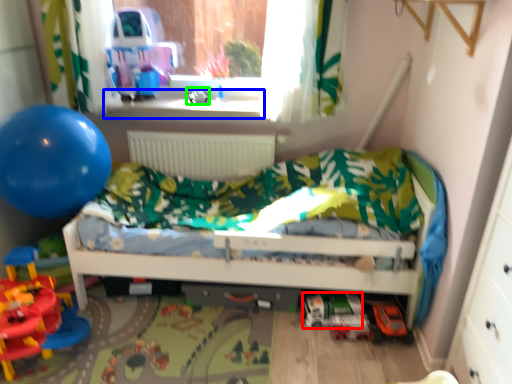
Question: Which object is positioned closest to toy (highlighted by a red box)? Select from window sill (highlighted by a blue box) and toy (highlighted by a green box).

Choices:
 (A) window sill
 (B) toy

Answer: (A)